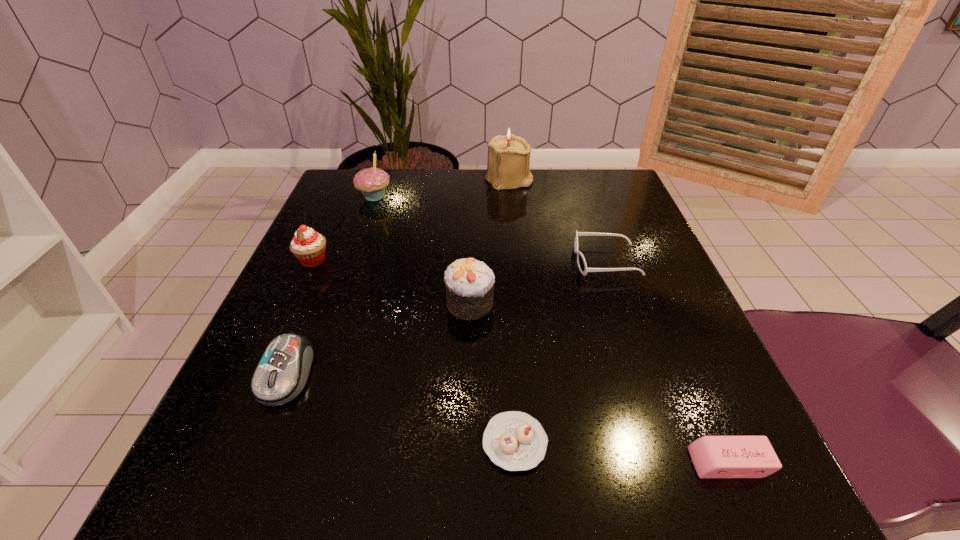
This screenshot has width=960, height=540. Find the location of `cupcake positioned at the far edge`. cupcake positioned at the far edge is located at coordinates (372, 182).

At what (x,y) coordinates should I click in order to perform the action: click on cupcake that is at the near edge. Please return your answer as a coordinate pair (x, y). Image resolution: width=960 pixels, height=540 pixels. Looking at the image, I should click on (515, 441).

This screenshot has height=540, width=960. In order to click on eraser that is at the near edge in this screenshot , I will do `click(714, 457)`.

The image size is (960, 540). I want to click on computer mouse located at the left edge, so click(x=282, y=373).

Where is `sunglasses situated at the right edge`? sunglasses situated at the right edge is located at coordinates (582, 265).

I want to click on eraser at the right edge, so click(x=714, y=457).

The image size is (960, 540). In order to click on object located in the far left corner section of the desktop in this screenshot , I will do [372, 182].

Where is `object at the near right corner`? object at the near right corner is located at coordinates (714, 457).

The width and height of the screenshot is (960, 540). In the image, there is a desktop. Find the location of `free space at the far edge`. free space at the far edge is located at coordinates (473, 173).

At what (x,y) coordinates should I click in order to perform the action: click on vacant space at the near edge of the desktop. Please return your answer as a coordinate pair (x, y). Image resolution: width=960 pixels, height=540 pixels. Looking at the image, I should click on (541, 474).